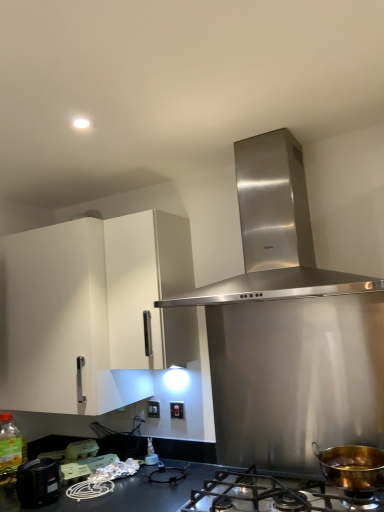
Question: Looking at the image, does matte black switch at center, which ranks as the first electric outlet in right-to-left order, seem bigger or smaller compared to white matte cabinet at upper left?

Choices:
 (A) small
 (B) big

Answer: (A)

Question: From a real-world perspective, is matte black switch at center, which ranks as the first electric outlet in right-to-left order, positioned above or below white matte cabinet at upper left?

Choices:
 (A) below
 (B) above

Answer: (A)

Question: Which object is positioned farthest from the matte black switch at center, which is counted as the 1th electric outlet, starting from the front?

Choices:
 (A) black plastic container at lower left, which is the first appliance in front-to-back order
 (B) translucent plastic bottle at center, which appears as the 1th bottle when viewed from the right
 (C) white plastic electric outlet at center, the first electric outlet from the left
 (D) white plastic eggs at lower left, positioned as the 3th appliance in front-to-back order
 (E) white matte cabinet at upper left

Answer: (E)

Question: Based on their relative distances, which object is nearer to the stainless steel gas stove at lower center?

Choices:
 (A) white plastic eggs at lower left, positioned as the 3th appliance in front-to-back order
 (B) white matte cabinet at upper left
 (C) matte black switch at center, the 2th electric outlet from the left
 (D) black plastic container at lower left, which is the first appliance in front-to-back order
 (E) stainless steel range hood at center

Answer: (C)